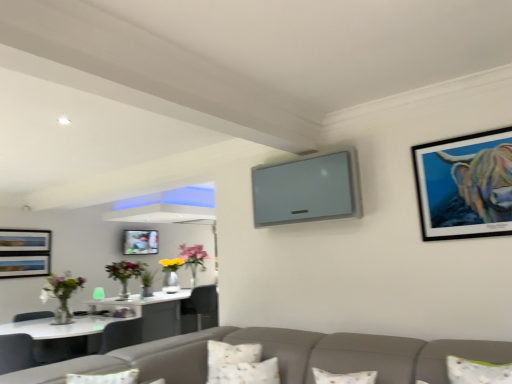
At what (x,y) coordinates should I click in order to perform the action: click on empty space that is ontop of metallic black frame at upper right, the 2th picture frame in the bottom-to-top sequence (from a real-world perspective). Please return your answer as a coordinate pair (x, y). Image resolution: width=512 pixels, height=384 pixels. Looking at the image, I should click on (453, 135).